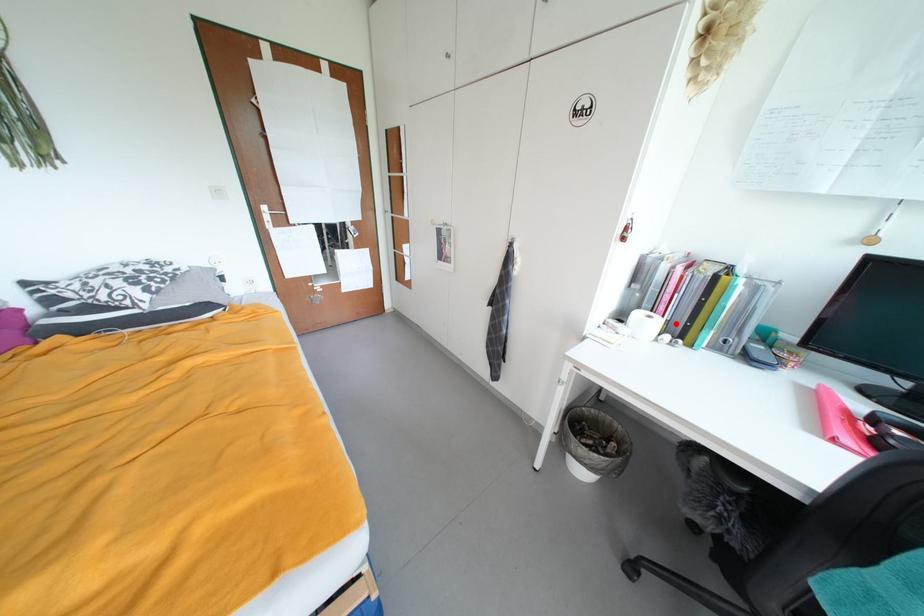
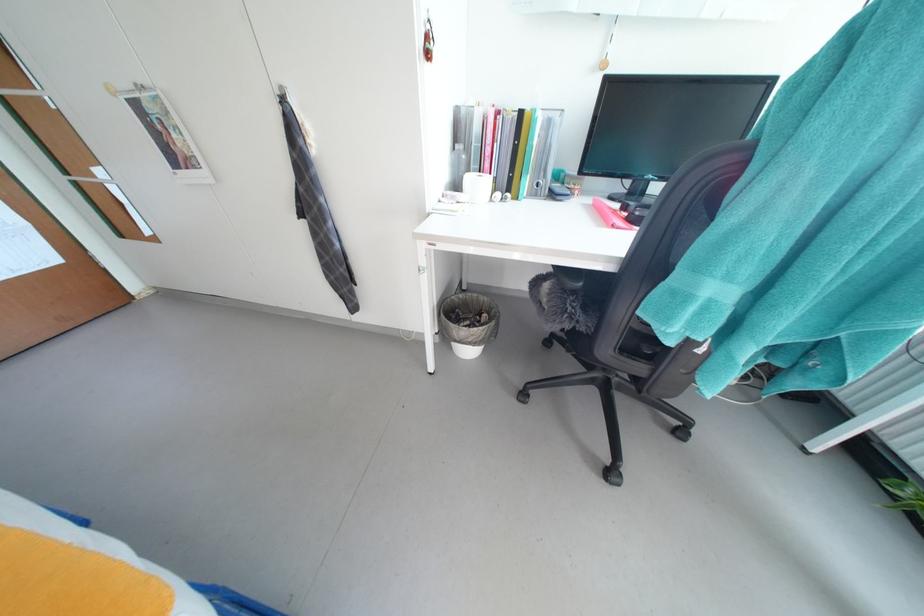
In the second image, find the point that corresponds to the highlighted location in the first image.

(503, 182)